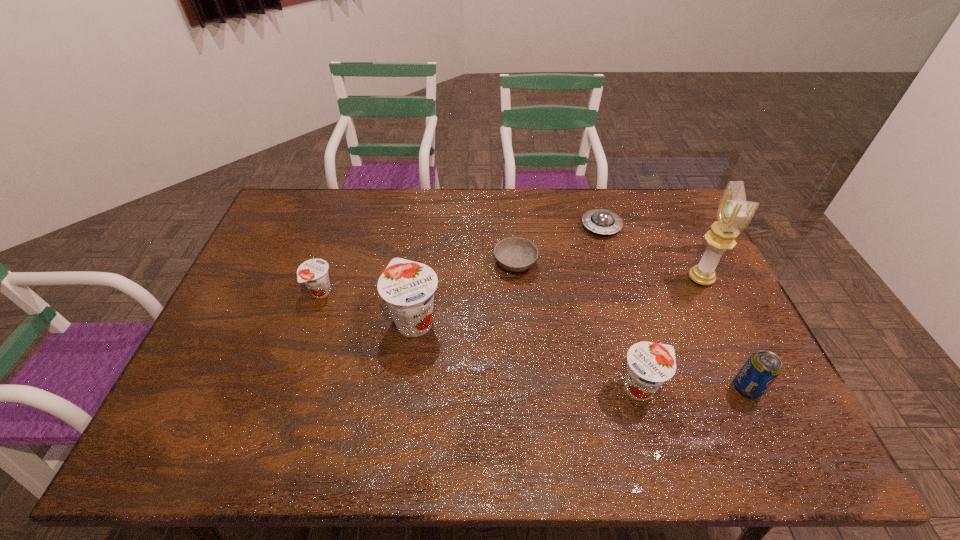
Locate an element on the screen. Image resolution: width=960 pixels, height=540 pixels. yogurt present at the near edge is located at coordinates (650, 364).

The image size is (960, 540). In order to click on soda that is at the near edge in this screenshot , I will do `click(762, 368)`.

You are a GUI agent. You are given a task and a screenshot of the screen. Output one action in this format:
    pyautogui.click(x=<x>, y=<y>)
    Task: Click on the award present at the right edge
    
    Given the screenshot: What is the action you would take?
    pyautogui.click(x=734, y=214)

Find the location of `soda that is at the right edge`. soda that is at the right edge is located at coordinates (762, 368).

Locate an element on the screen. object that is at the near right corner is located at coordinates (762, 368).

In the image, there is a desktop. Find the location of `vacant region at the far edge`. vacant region at the far edge is located at coordinates [336, 220].

Image resolution: width=960 pixels, height=540 pixels. In order to click on free space at the near edge of the desktop in this screenshot , I will do `click(361, 398)`.

In the image, there is a desktop. Where is `vacant region at the left edge`? vacant region at the left edge is located at coordinates (300, 232).

In order to click on vacant space at the right edge in this screenshot , I will do `click(749, 353)`.

This screenshot has height=540, width=960. Identify the location of blank space at the far right corner of the desktop. (656, 206).